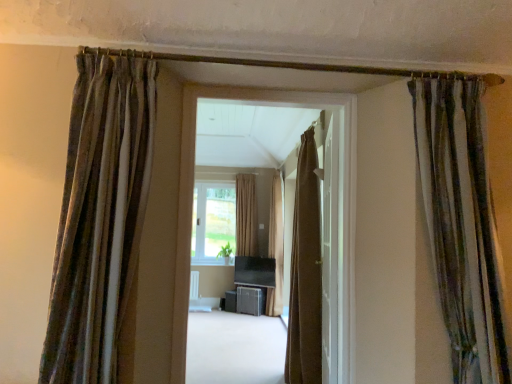
Question: Can you confirm if velvet striped curtain at upper left, placed as the 1th curtain when sorted from left to right, is thinner than brown textured curtain at center, acting as the third curtain starting from the front?

Choices:
 (A) yes
 (B) no

Answer: (A)

Question: Is velvet striped curtain at upper left, acting as the fifth curtain starting from the right, shorter than brown textured curtain at center, which ranks as the 4th curtain in left-to-right order?

Choices:
 (A) yes
 (B) no

Answer: (A)

Question: Is velvet striped curtain at upper left, marked as the first curtain in a front-to-back arrangement, at the right side of brown textured curtain at center, positioned as the 2th curtain in right-to-left order?

Choices:
 (A) yes
 (B) no

Answer: (B)

Question: Is velvet striped curtain at upper left, acting as the fifth curtain starting from the right, outside brown textured curtain at center, acting as the third curtain starting from the front?

Choices:
 (A) yes
 (B) no

Answer: (A)

Question: Is brown textured curtain at center, acting as the third curtain starting from the front, at the back of velvet striped curtain at upper left, placed as the 5th curtain when sorted from back to front?

Choices:
 (A) yes
 (B) no

Answer: (B)

Question: Is beige fabric curtain at center, the fifth curtain from the front, in front of or behind striped fabric curtain at right, which is the 1th curtain in right-to-left order, in the image?

Choices:
 (A) behind
 (B) front

Answer: (A)

Question: Is point (256, 216) closer or farther from the camera than point (481, 355)?

Choices:
 (A) closer
 (B) farther

Answer: (B)

Question: Which is correct: beige fabric curtain at center, placed as the 4th curtain when sorted from right to left, is inside striped fabric curtain at right, which is the 1th curtain in right-to-left order, or outside of it?

Choices:
 (A) outside
 (B) inside

Answer: (A)

Question: Considering the relative positions of beige fabric curtain at center, acting as the 2th curtain starting from the left, and striped fabric curtain at right, which is the 1th curtain in right-to-left order, in the image provided, is beige fabric curtain at center, acting as the 2th curtain starting from the left, to the left or to the right of striped fabric curtain at right, which is the 1th curtain in right-to-left order,?

Choices:
 (A) left
 (B) right

Answer: (A)

Question: Looking at the image, does brown textured curtain at center, the 3th curtain in the left-to-right sequence, seem bigger or smaller compared to velvet striped curtain at upper left, marked as the first curtain in a front-to-back arrangement?

Choices:
 (A) big
 (B) small

Answer: (A)

Question: From their relative heights in the image, would you say brown textured curtain at center, the fourth curtain in the front-to-back sequence, is taller or shorter than velvet striped curtain at upper left, marked as the first curtain in a front-to-back arrangement?

Choices:
 (A) short
 (B) tall

Answer: (B)

Question: In the image, is brown textured curtain at center, the fourth curtain in the front-to-back sequence, on the left side or the right side of velvet striped curtain at upper left, marked as the first curtain in a front-to-back arrangement?

Choices:
 (A) right
 (B) left

Answer: (A)

Question: Is point (274, 238) closer or farther from the camera than point (84, 243)?

Choices:
 (A) closer
 (B) farther

Answer: (B)

Question: Looking at the image, does smooth beige carpet at center seem bigger or smaller compared to brown textured curtain at center, the third curtain viewed from the right?

Choices:
 (A) big
 (B) small

Answer: (A)

Question: Is point (238, 370) closer or farther from the camera than point (270, 192)?

Choices:
 (A) farther
 (B) closer

Answer: (B)